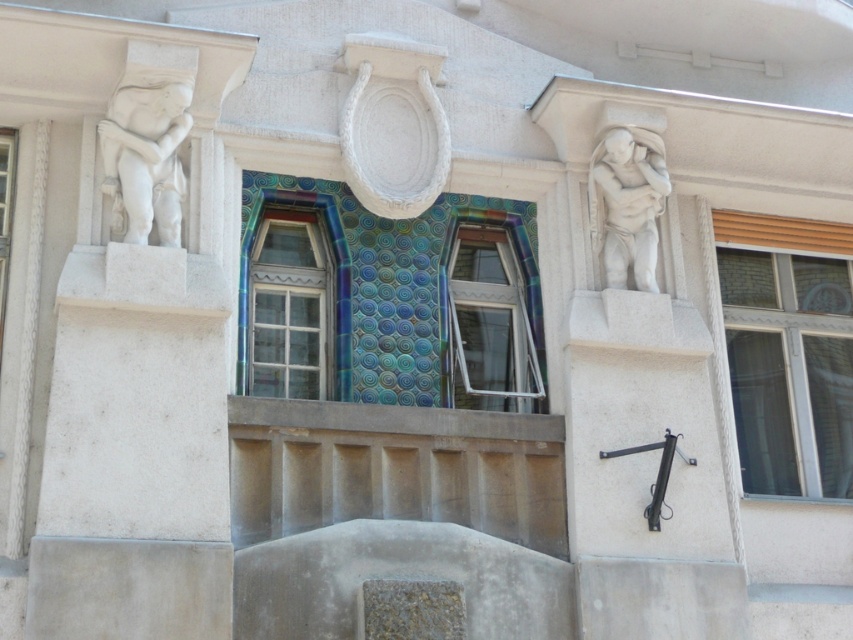
You are an architect examining the building facade. You need to determine the visibility of the clear glass window at left from a street level perspective. Considering the white marble statue at upper left, will the window be obscured?

The clear glass window at left is behind the white marble statue at upper left, so it will be obscured from the street level view.

You are an architect examining the building facade. You need to install a new light fixture between the white plastic window at center and the white marble statue at upper left. Based on their positions, where should you place the light fixture?

The white plastic window at center is to the right of the white marble statue at upper left, so the light fixture should be placed between them, to the right of the white marble statue at upper left and to the left of the white plastic window at center.

You are an architect examining the building facade. You need to determine the relative positions of the white stone sculpture at right and the multicolored mosaic tile at center. Which object is located to the right of the other?

The white stone sculpture at right is located to the right of the multicolored mosaic tile at center.